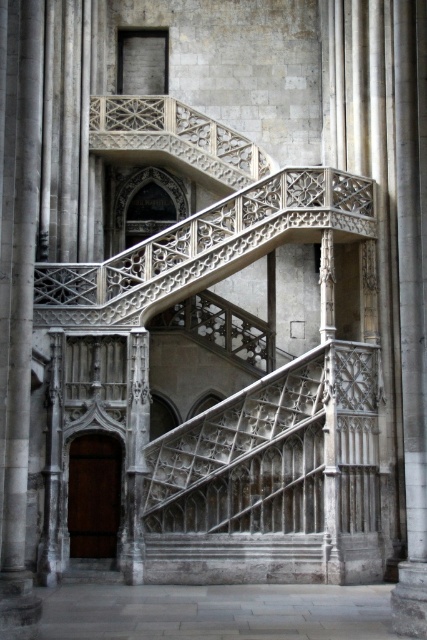
You are an architect examining this historic building. You notice a point marked at coordinates (272, 480). Based on the scene description, what architectural feature does this point most likely correspond to?

The point at coordinates (272, 480) corresponds to the white stone staircase at center, as indicated by the Objects Description.

You are an architect examining the historic building. You need to determine if the white stone staircase at center can accommodate a large sculpture that requires a minimum width of 3 meters. Given that the smooth stone pillar at center is 2 meters wide, can the staircase potentially fit the sculpture?

The white stone staircase at center might be wider than the smooth stone pillar at center, which is 2 meters wide. Therefore, it is possible that the staircase could accommodate the sculpture requiring 3 meters width, but further measurement is needed to confirm.

You are an architect examining the historic building and need to determine the relative sizes of the white stone staircase at center and the smooth stone pillar at center. Which object is smaller?

The white stone staircase at center has a smaller size compared to the smooth stone pillar at center, so the white stone staircase at center is smaller.